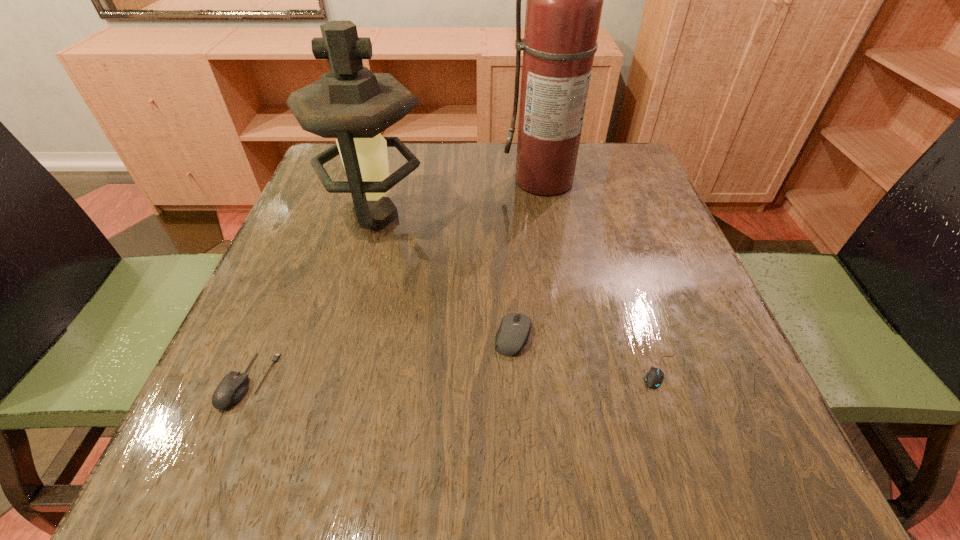
Where is `the tallest object`? The height and width of the screenshot is (540, 960). the tallest object is located at coordinates (564, 0).

Identify the location of oil lamp. (350, 103).

Image resolution: width=960 pixels, height=540 pixels. What are the coordinates of `the tallest mouse` in the screenshot? It's located at (514, 330).

You are a GUI agent. You are given a task and a screenshot of the screen. Output one action in this format:
    pyautogui.click(x=<x>, y=<y>)
    Task: Click on the third shortest object
    
    Given the screenshot: What is the action you would take?
    pyautogui.click(x=514, y=330)

Where is `the second shortest mouse`? The image size is (960, 540). the second shortest mouse is located at coordinates (232, 388).

This screenshot has width=960, height=540. What are the coordinates of `the leftmost mouse` in the screenshot? It's located at (232, 388).

I want to click on the rightmost mouse, so click(x=653, y=378).

What are the coordinates of `the shortest object` in the screenshot? It's located at (653, 378).

What are the coordinates of `vacant space located 0.360m on the front-facing side of the fire extinguisher` in the screenshot? It's located at (571, 318).

Locate an element on the screen. This screenshot has height=540, width=960. free space located on the front of the second tallest object is located at coordinates (347, 325).